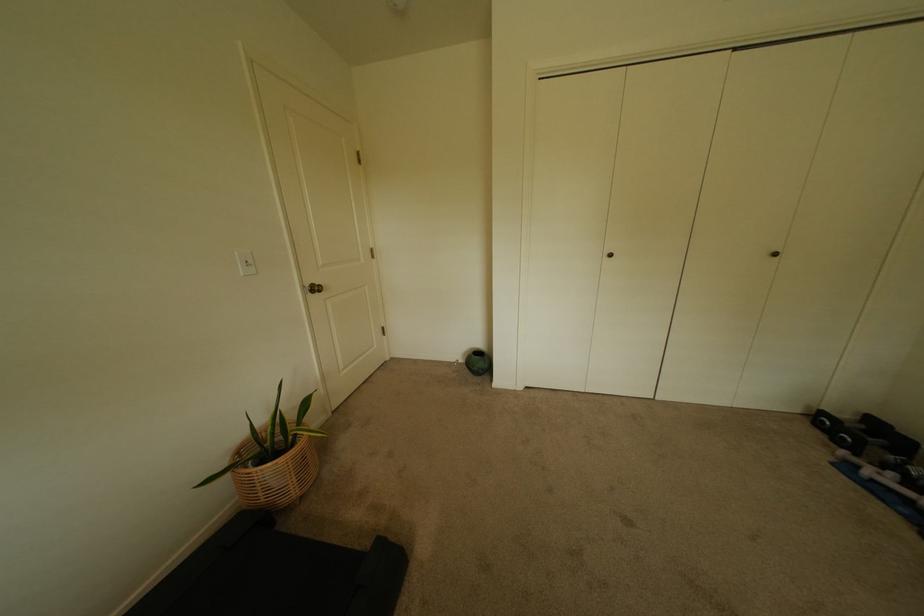
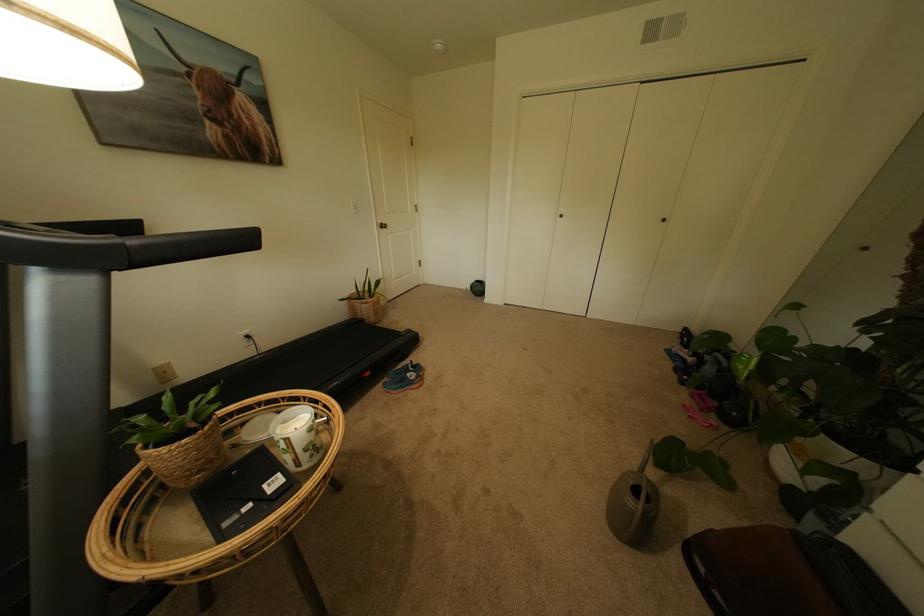
The point at (329,293) is marked in the first image. Where is the corresponding point in the second image?

(394, 229)